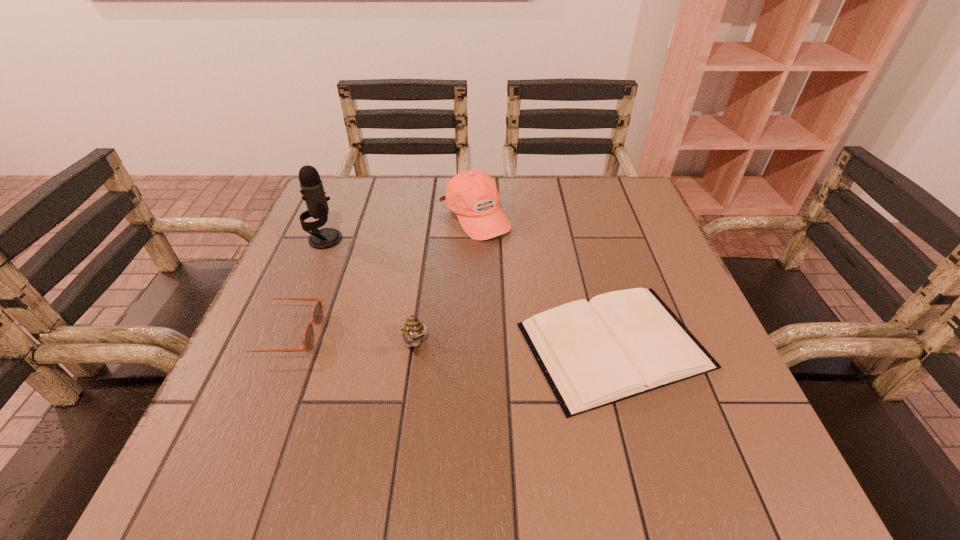
Image resolution: width=960 pixels, height=540 pixels. Find the location of `free space between the third tallest object and the fourth shortest object`. free space between the third tallest object and the fourth shortest object is located at coordinates (444, 281).

In order to click on empty location between the shortest object and the third shortest object in this screenshot , I will do `click(515, 345)`.

Find the location of a particular element. free space between the hardback book and the baseball cap is located at coordinates (544, 281).

What are the coordinates of `empty space between the second tallest object and the microphone` in the screenshot? It's located at (399, 228).

Identify the location of vacant area that lies between the fourth tallest object and the third tallest object. The width and height of the screenshot is (960, 540). (348, 339).

Locate an element on the screen. This screenshot has width=960, height=540. empty location between the tallest object and the hardback book is located at coordinates (469, 292).

Locate an element on the screen. The image size is (960, 540). vacant area that lies between the microphone and the third shortest object is located at coordinates (370, 292).

You are a GUI agent. You are given a task and a screenshot of the screen. Output one action in this format:
    pyautogui.click(x=<x>, y=<y>)
    Task: Click on the free space between the microphone and the baseball cap
    The image size is (960, 540).
    Given the screenshot: What is the action you would take?
    pyautogui.click(x=399, y=228)

You are a GUI agent. You are given a task and a screenshot of the screen. Output one action in this format:
    pyautogui.click(x=<x>, y=<y>)
    Task: Click on the unoccupied area between the shortest object and the snail
    
    Given the screenshot: What is the action you would take?
    pyautogui.click(x=515, y=345)

Identify the location of free point between the fourth tallest object and the baseball cap. tap(379, 275).